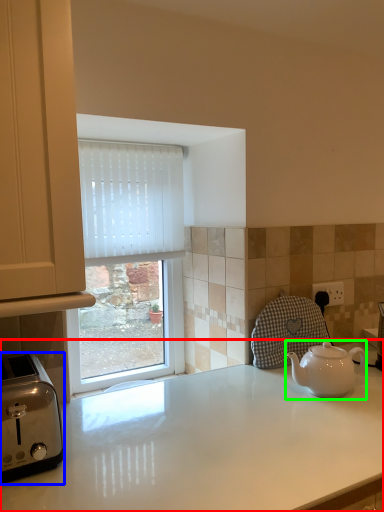
Question: Which object is positioned closest to countertop (highlighted by a red box)? Select from toaster (highlighted by a blue box) and kettle (highlighted by a green box).

Choices:
 (A) toaster
 (B) kettle

Answer: (B)